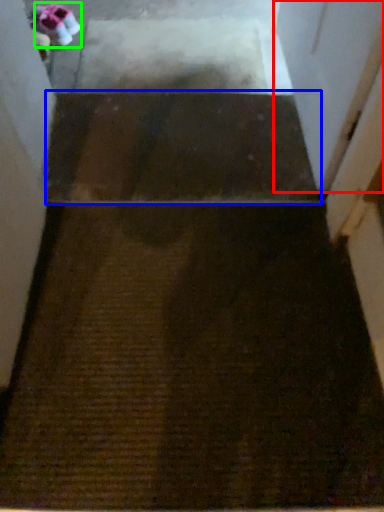
Question: Considering the real-world distances, which object is farthest from screen door (highlighted by a red box)? stairwell (highlighted by a blue box) or shoe (highlighted by a green box)?

Choices:
 (A) stairwell
 (B) shoe

Answer: (B)